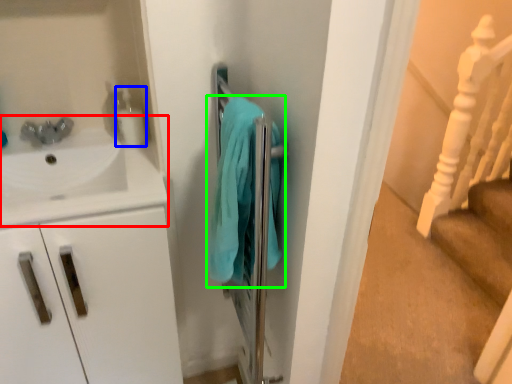
Question: Which is nearer to the sink (highlighted by a red box)? soap dispenser (highlighted by a blue box) or bath towel (highlighted by a green box).

Choices:
 (A) soap dispenser
 (B) bath towel

Answer: (A)